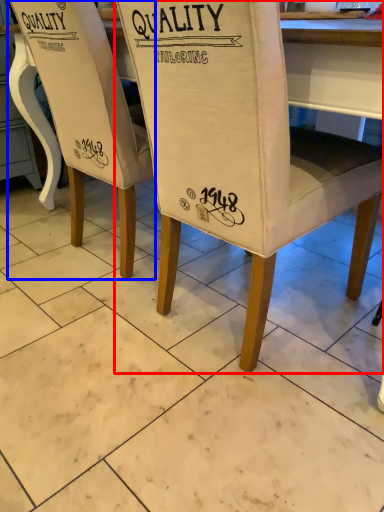
Question: Among these objects, which one is farthest to the camera, chair (highlighted by a red box) or chair (highlighted by a blue box)?

Choices:
 (A) chair
 (B) chair

Answer: (B)